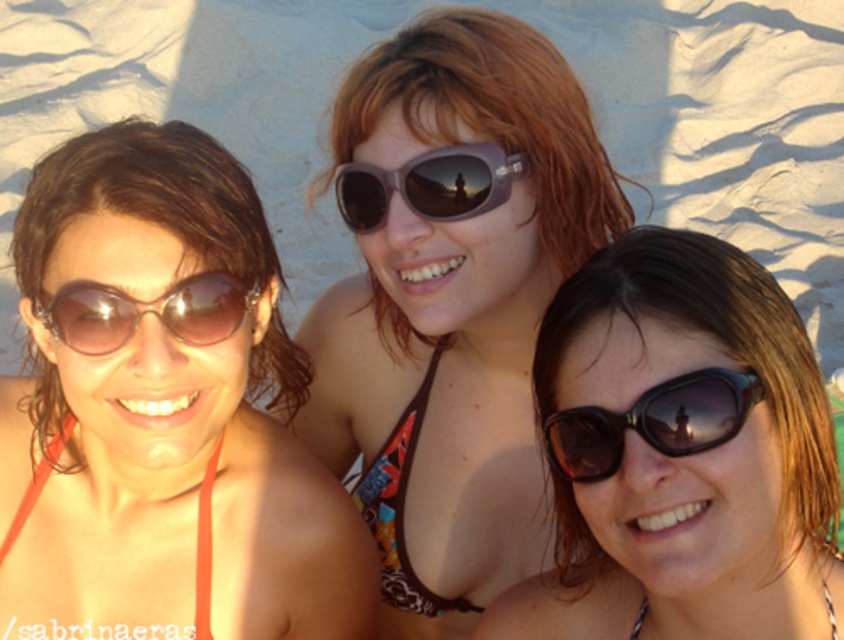
Is point (215, 296) closer to camera compared to point (450, 145)?

Yes, it is in front of point (450, 145).

Image resolution: width=844 pixels, height=640 pixels. Identify the location of matte brown sunglasses at left. (147, 312).

Is black plastic sunglasses at center to the right of black matte sunglasses at lower right from the viewer's perspective?

Correct, you'll find black plastic sunglasses at center to the right of black matte sunglasses at lower right.

Is black plastic sunglasses at center wider than black matte sunglasses at lower right?

Yes.

Does point (691, 308) come behind point (647, 420)?

Yes.

Where is `black plastic sunglasses at center`? Image resolution: width=844 pixels, height=640 pixels. black plastic sunglasses at center is located at coordinates (680, 454).

Between matte orange bikini top at left and matte brown bikini top at center, which one has less height?

matte orange bikini top at left

Between point (26, 497) and point (472, 611), which one is positioned behind?

Positioned behind is point (472, 611).

What do you see at coordinates (161, 412) in the screenshot?
I see `matte orange bikini top at left` at bounding box center [161, 412].

You are a GUI agent. You are given a task and a screenshot of the screen. Output one action in this format:
    pyautogui.click(x=<x>, y=<y>)
    Task: Click on the matte orange bikini top at left
    The width and height of the screenshot is (844, 640).
    Given the screenshot: What is the action you would take?
    pyautogui.click(x=161, y=412)